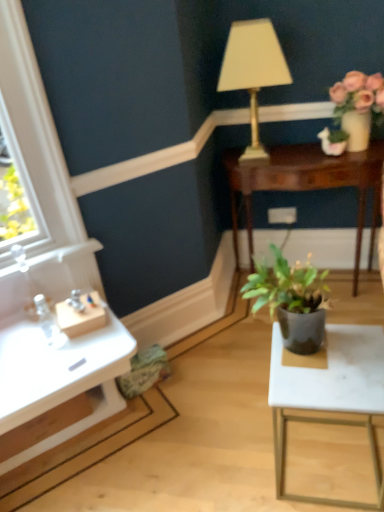
Question: Can you confirm if white marble table at lower right, which is the second table in top-to-bottom order, is positioned to the left of gold metallic lamp at upper center?

Choices:
 (A) yes
 (B) no

Answer: (B)

Question: Is gold metallic lamp at upper center inside white marble table at lower right, positioned as the second table in back-to-front order?

Choices:
 (A) no
 (B) yes

Answer: (A)

Question: Considering the relative sizes of white marble table at lower right, which ranks as the first table in front-to-back order, and gold metallic lamp at upper center in the image provided, is white marble table at lower right, which ranks as the first table in front-to-back order, bigger than gold metallic lamp at upper center?

Choices:
 (A) no
 (B) yes

Answer: (A)

Question: From a real-world perspective, does white marble table at lower right, which is the second table in top-to-bottom order, sit lower than gold metallic lamp at upper center?

Choices:
 (A) no
 (B) yes

Answer: (B)

Question: Can you confirm if white marble table at lower right, which ranks as the first table in front-to-back order, is thinner than gold metallic lamp at upper center?

Choices:
 (A) no
 (B) yes

Answer: (A)

Question: From a real-world perspective, is gold metallic lamp at upper center positioned above or below matte pink flowers at upper right?

Choices:
 (A) below
 (B) above

Answer: (B)

Question: Would you say gold metallic lamp at upper center is to the left or to the right of matte pink flowers at upper right in the picture?

Choices:
 (A) right
 (B) left

Answer: (B)

Question: From the image's perspective, is gold metallic lamp at upper center positioned above or below matte pink flowers at upper right?

Choices:
 (A) below
 (B) above

Answer: (B)

Question: Is gold metallic lamp at upper center situated inside matte pink flowers at upper right or outside?

Choices:
 (A) outside
 (B) inside

Answer: (A)

Question: From a real-world perspective, is gold metallic lamp at upper center physically located above or below dark green matte plant pot at center, which ranks as the second houseplant in top-to-bottom order?

Choices:
 (A) below
 (B) above

Answer: (B)

Question: Considering their positions, is gold metallic lamp at upper center located in front of or behind dark green matte plant pot at center, positioned as the first houseplant in front-to-back order?

Choices:
 (A) front
 (B) behind

Answer: (B)

Question: From their relative heights in the image, would you say gold metallic lamp at upper center is taller or shorter than dark green matte plant pot at center, acting as the second houseplant starting from the right?

Choices:
 (A) tall
 (B) short

Answer: (A)

Question: Do you think gold metallic lamp at upper center is within dark green matte plant pot at center, positioned as the first houseplant in front-to-back order, or outside of it?

Choices:
 (A) outside
 (B) inside

Answer: (A)

Question: From the image's perspective, is green matte plant pot at upper right, positioned as the 1th houseplant in top-to-bottom order, positioned above or below gold metallic lamp at upper center?

Choices:
 (A) below
 (B) above

Answer: (A)

Question: Looking at their shapes, would you say green matte plant pot at upper right, which ranks as the second houseplant in left-to-right order, is wider or thinner than gold metallic lamp at upper center?

Choices:
 (A) wide
 (B) thin

Answer: (B)